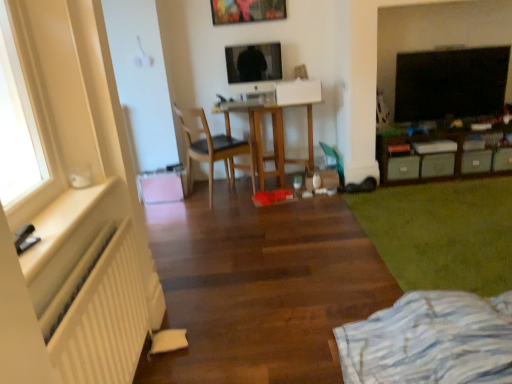
The image size is (512, 384). In order to click on blank space situated above green plush carpet at lower right (from a real-world perspective) in this screenshot , I will do `click(450, 224)`.